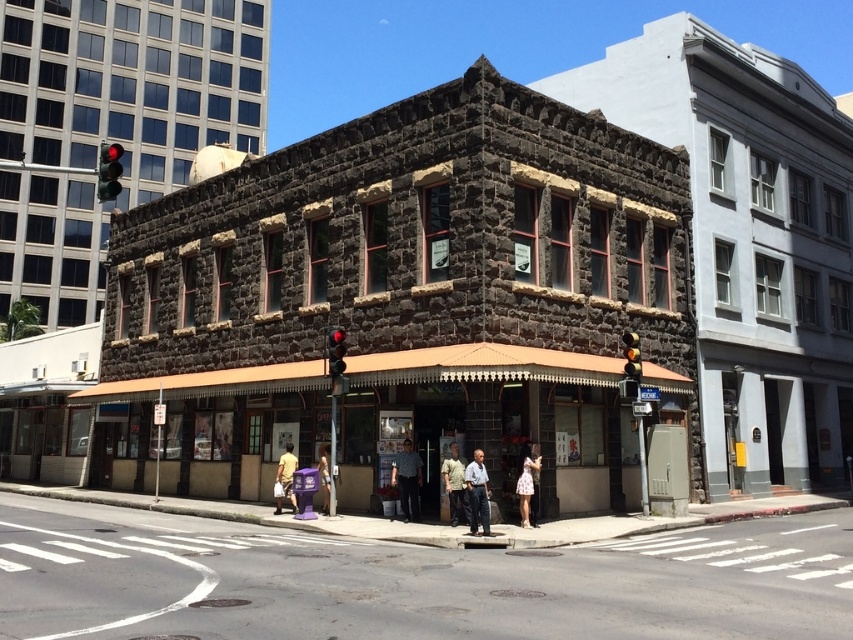
Does red glass traffic light at center have a greater height compared to yellow matte traffic light at upper right?

Yes.

Is red glass traffic light at center bigger than yellow matte traffic light at upper right?

Yes, red glass traffic light at center is bigger than yellow matte traffic light at upper right.

Is point (340, 356) positioned before point (637, 356)?

Yes, point (340, 356) is in front of point (637, 356).

Find the location of `red glass traffic light at center`. red glass traffic light at center is located at coordinates pyautogui.click(x=335, y=352).

Does light brown fabric shirt at lower center have a smaller size compared to red glass traffic light at center?

No, light brown fabric shirt at lower center is not smaller than red glass traffic light at center.

Identify the location of light brown fabric shirt at lower center. click(x=285, y=476).

The height and width of the screenshot is (640, 853). Find the location of `light brown fabric shirt at lower center`. light brown fabric shirt at lower center is located at coordinates (285, 476).

This screenshot has width=853, height=640. In order to click on light brown fabric shirt at lower center in this screenshot , I will do `click(285, 476)`.

Does yellow matte traffic light at upper right appear on the right side of light brown hair at center?

Yes, yellow matte traffic light at upper right is to the right of light brown hair at center.

Which is in front, point (636, 371) or point (328, 500)?

Point (636, 371) is more forward.

Does point (625, 360) come in front of point (321, 468)?

That is False.

At what (x,y) coordinates should I click in order to perform the action: click on yellow matte traffic light at upper right. Please return your answer as a coordinate pair (x, y). Looking at the image, I should click on (631, 355).